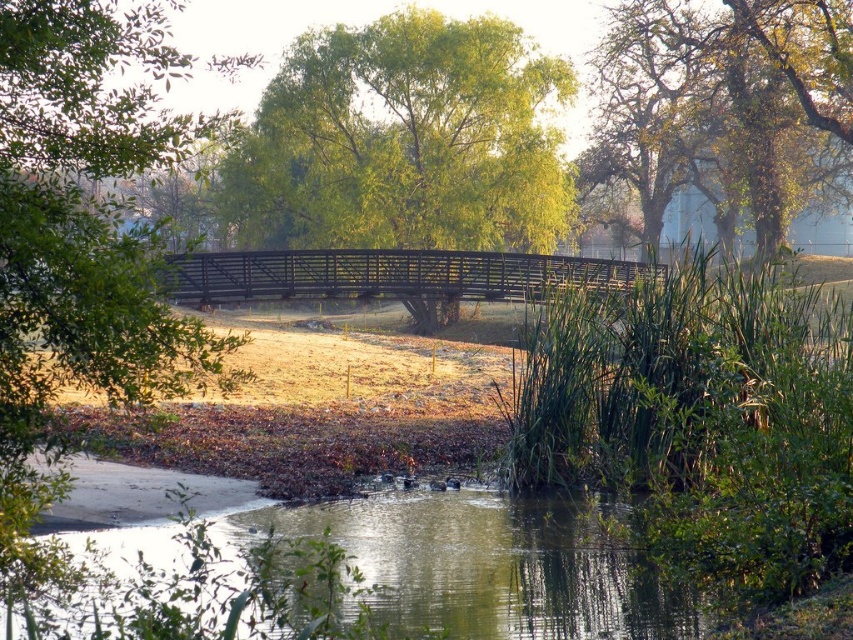
You are standing on the wooden bridge at center and want to look towards the green leafy tree at upper right. In which direction should you turn your head?

You should turn your head to the right because the green leafy tree at upper right is located to the right of the wooden bridge at center.

You are standing on the wooden bridge and see two points marked in the scene. Which point is closer to you, point (103,227) or point (316,288)?

Point (103,227) is in front of point (316,288), so it is closer to you.

You are standing at the center of the wooden bridge and want to locate the green leafy tree at upper right. According to the coordinates provided, in which direction should you look to find it?

The green leafy tree at upper right is located at coordinates point (724, 112), which corresponds to the upper right direction from your position at the center of the wooden bridge.